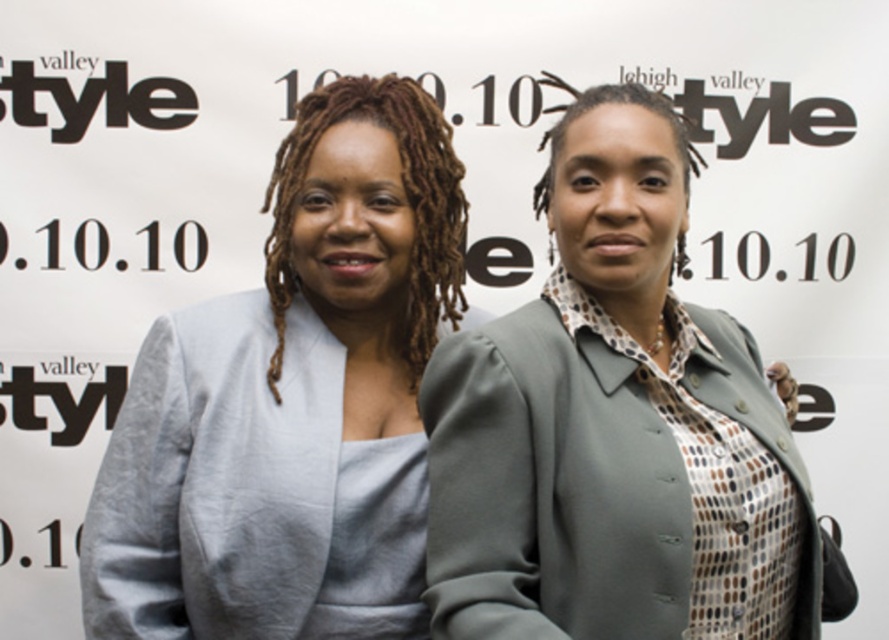
You are a fashion designer observing two people in the image. The first person is wearing a matte gray blazer at center, and the second person is wearing a matte gray blazer at left. Which blazer is larger in size?

The matte gray blazer at center is bigger than the matte gray blazer at left.

You are a fashion designer trying to create a new collection inspired by the two individuals in the image. The two matte gray blazers are part of your design inspiration. How far apart are the matte gray blazer at center and the matte gray blazer at left?

The matte gray blazer at center is 14.29 inches away from the matte gray blazer at left.

From the picture: You are organizing a fashion show and need to arrange two models wearing matte gray blazers. The models are currently positioned such that the matte gray blazer at center and the matte gray blazer at left are part of the setup. According to the scene description, which matte gray blazer is positioned to the right of the other?

The matte gray blazer at center is positioned on the right side of the matte gray blazer at left, so the matte gray blazer at center is to the right of the matte gray blazer at left.